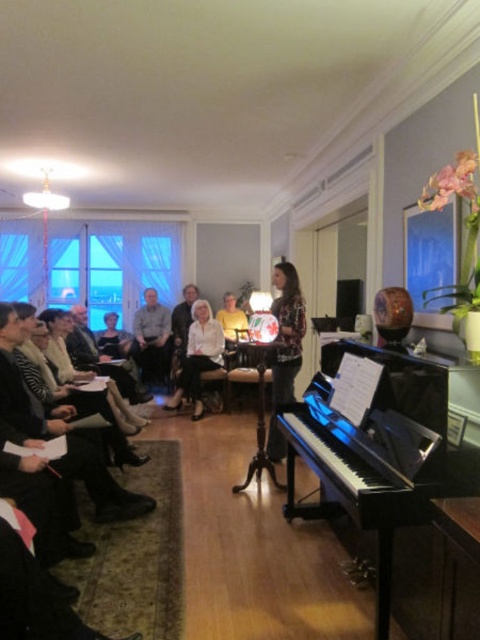
Is point (451, 493) closer to viewer compared to point (163, 308)?

That is True.

Is black polished piano at lower right further to the viewer compared to light brown fabric shirt at center?

That is False.

Who is more forward, (402, 369) or (165, 360)?

Point (402, 369)

Where is `black polished piano at lower right`? The image size is (480, 640). black polished piano at lower right is located at coordinates (376, 449).

Does matte white blouse at center have a greater width compared to light brown fabric shirt at center?

Correct, the width of matte white blouse at center exceeds that of light brown fabric shirt at center.

Is matte white blouse at center to the left of light brown fabric shirt at center from the viewer's perspective?

In fact, matte white blouse at center is to the right of light brown fabric shirt at center.

Identify the location of matte white blouse at center. The width and height of the screenshot is (480, 640). (199, 356).

At what (x,y) coordinates should I click in order to perform the action: click on matte white blouse at center. Please return your answer as a coordinate pair (x, y). Image resolution: width=480 pixels, height=640 pixels. Looking at the image, I should click on 199,356.

Does black polished piano at lower right have a larger size compared to matte white blouse at center?

Yes, black polished piano at lower right is bigger than matte white blouse at center.

This screenshot has height=640, width=480. Find the location of `black polished piano at lower right`. black polished piano at lower right is located at coordinates (376, 449).

Where is `black polished piano at lower right`? The height and width of the screenshot is (640, 480). black polished piano at lower right is located at coordinates (376, 449).